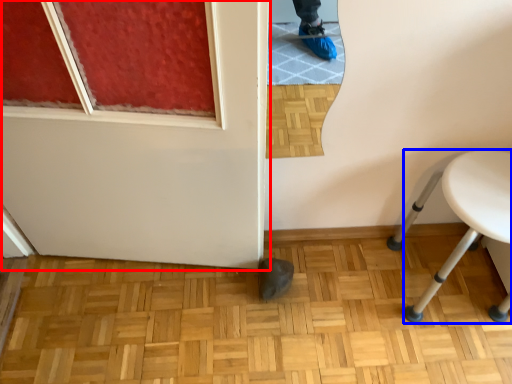
Question: Which point is closer to the camera, door (highlighted by a red box) or furniture (highlighted by a blue box)?

Choices:
 (A) door
 (B) furniture

Answer: (A)